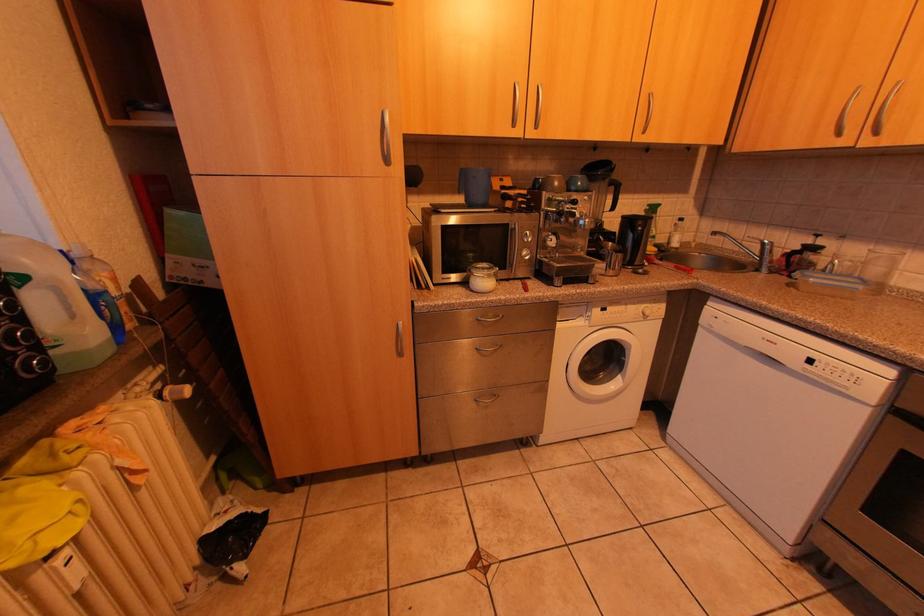
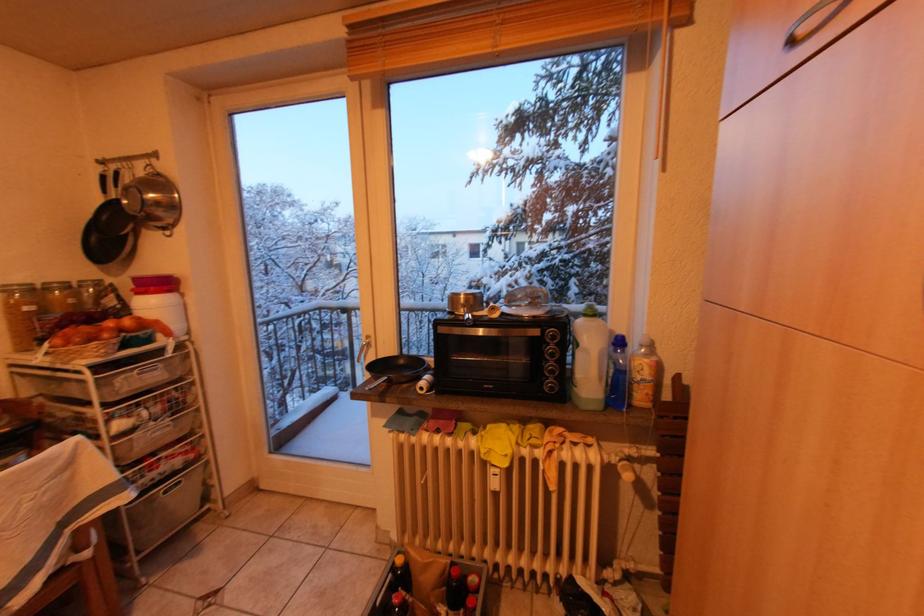
First-person continuous shooting, in which direction is the camera rotating?

The camera rotated toward left-down.